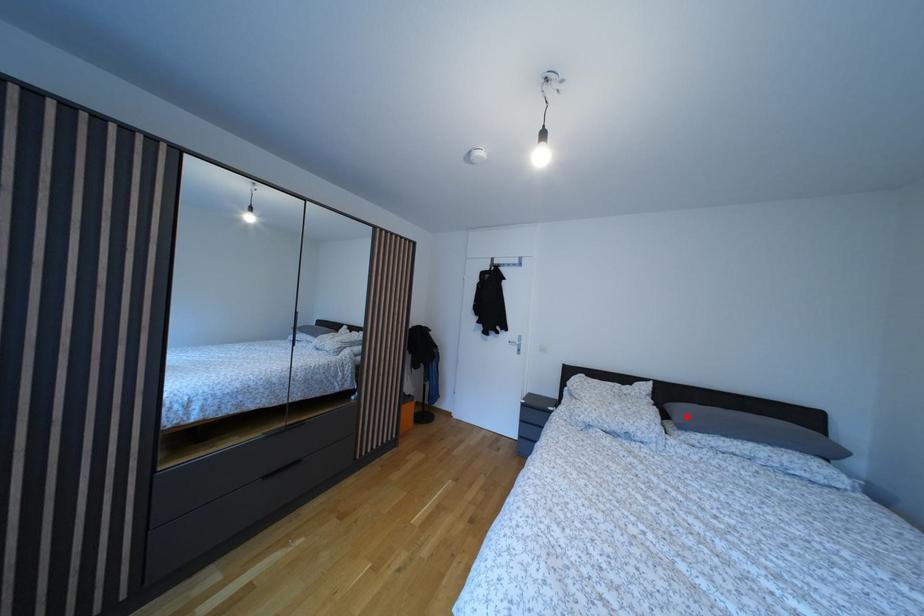
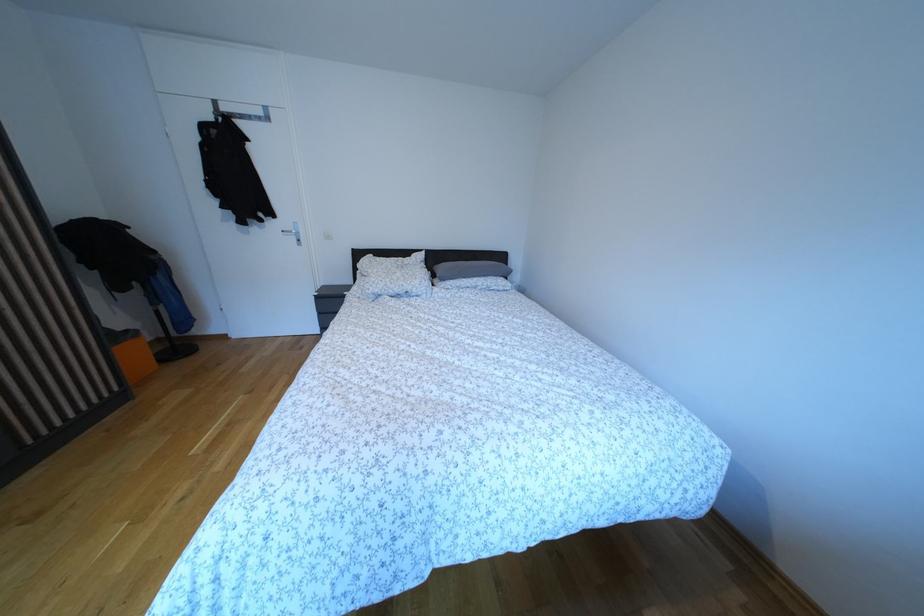
Question: I am providing you with two images of the same scene from different viewpoints. A red point is marked on the first image. At the location where the point appears in image 1, is it still visible in image 2?

Choices:
 (A) Yes
 (B) No

Answer: (A)